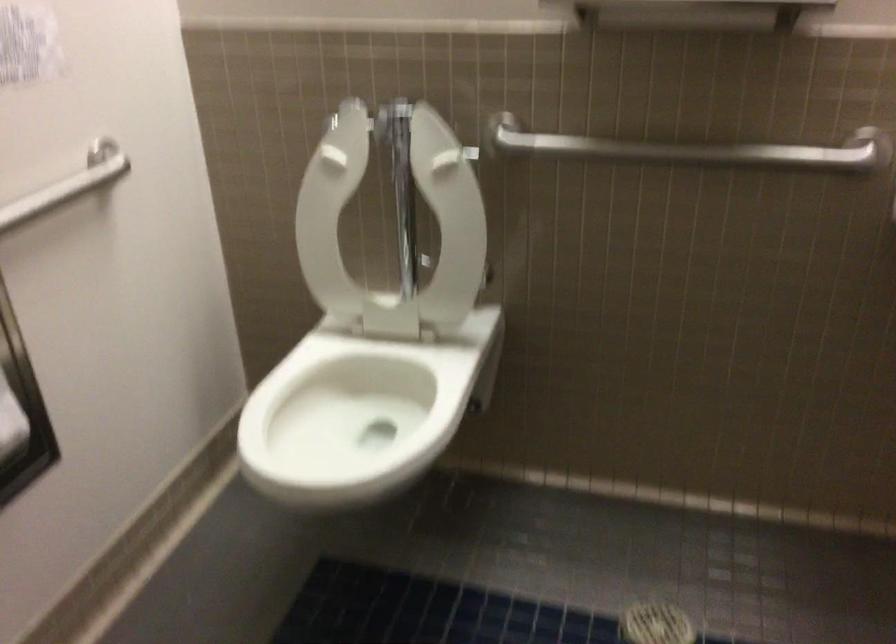
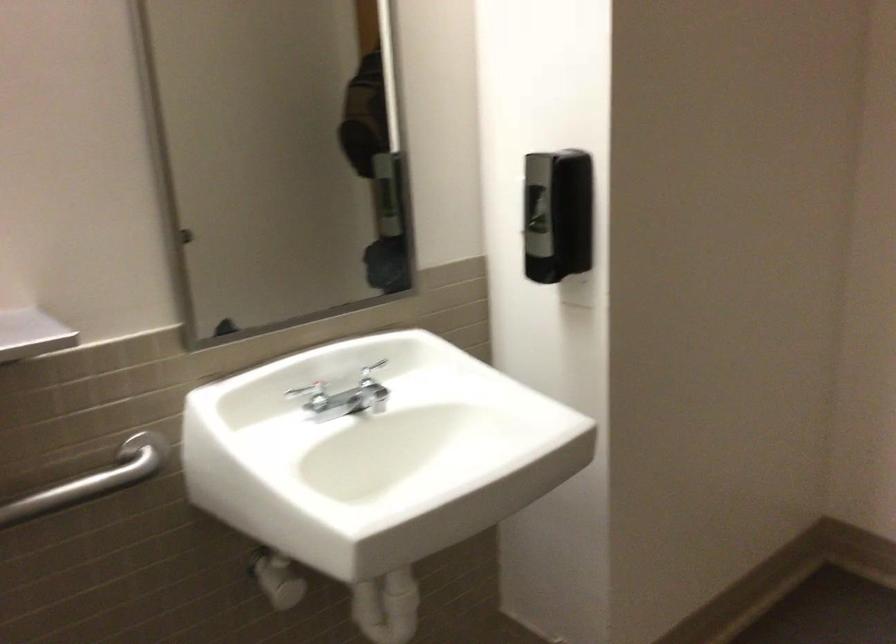
Where in the second image is the point corresponding to (793,145) from the first image?

(92, 480)